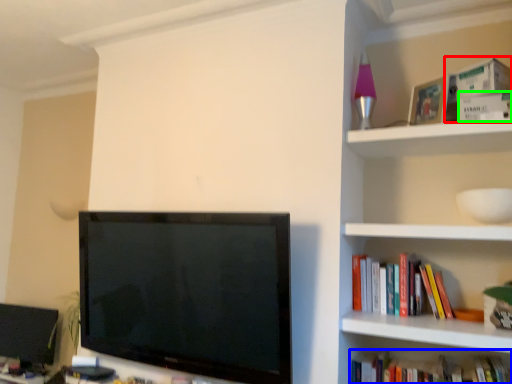
Question: Considering the real-world distances, which object is farthest from paperback book (highlighted by a red box)? book (highlighted by a blue box) or paperback book (highlighted by a green box)?

Choices:
 (A) book
 (B) paperback book

Answer: (A)